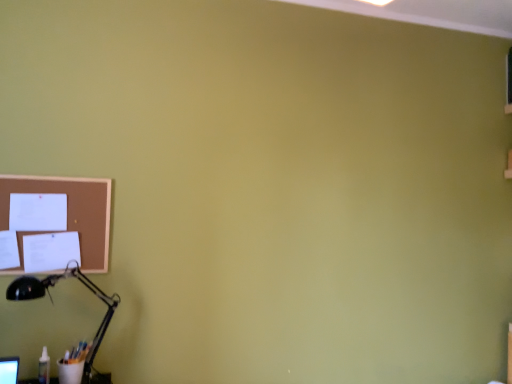
Question: From a real-world perspective, is brown corkboard at upper left positioned above or below black matte desk lamp at lower left?

Choices:
 (A) above
 (B) below

Answer: (A)

Question: Considering the relative positions of brown corkboard at upper left and black matte desk lamp at lower left in the image provided, is brown corkboard at upper left to the left or to the right of black matte desk lamp at lower left?

Choices:
 (A) right
 (B) left

Answer: (B)

Question: Is point (11, 190) positioned closer to the camera than point (84, 283)?

Choices:
 (A) closer
 (B) farther

Answer: (A)

Question: Which is correct: black matte desk lamp at lower left is inside brown corkboard at upper left, or outside of it?

Choices:
 (A) inside
 (B) outside

Answer: (B)

Question: From the image's perspective, is black matte desk lamp at lower left above or below brown corkboard at upper left?

Choices:
 (A) above
 (B) below

Answer: (B)

Question: Is black matte desk lamp at lower left in front of or behind brown corkboard at upper left in the image?

Choices:
 (A) front
 (B) behind

Answer: (A)

Question: Is black matte desk lamp at lower left bigger or smaller than brown corkboard at upper left?

Choices:
 (A) big
 (B) small

Answer: (A)